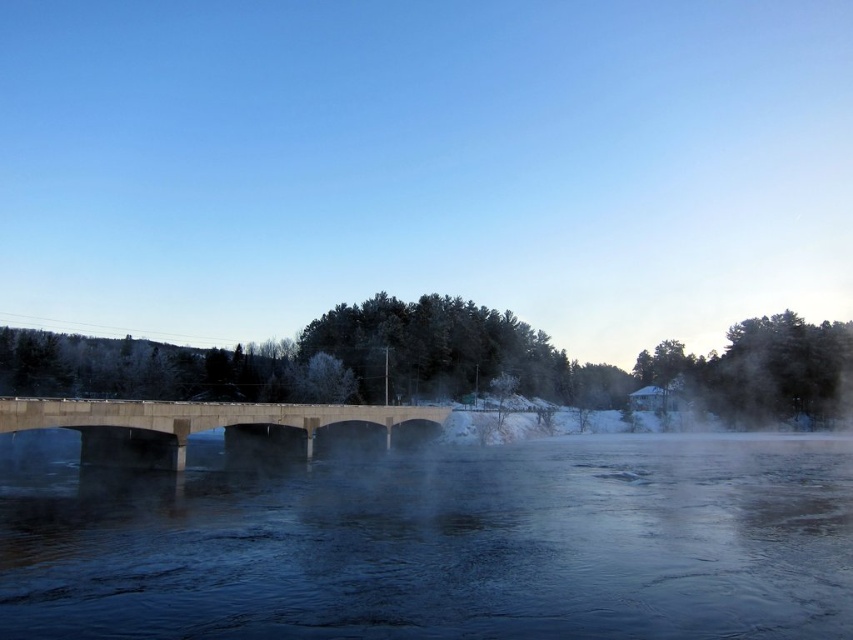
You are a delivery drone carrying a package and need to fly from the dark blue water at center to the concrete bridge at center. What is the minimum distance you must cover to reach the destination?

The minimum distance you must cover to reach the destination is 15.77 meters between the dark blue water at center and the concrete bridge at center.

Based on the photo, you are standing on the concrete bridge at center and looking towards the river. Which direction should you turn to see the dark blue water at center?

You should turn to your right because the dark blue water at center is to the right of the concrete bridge at center.